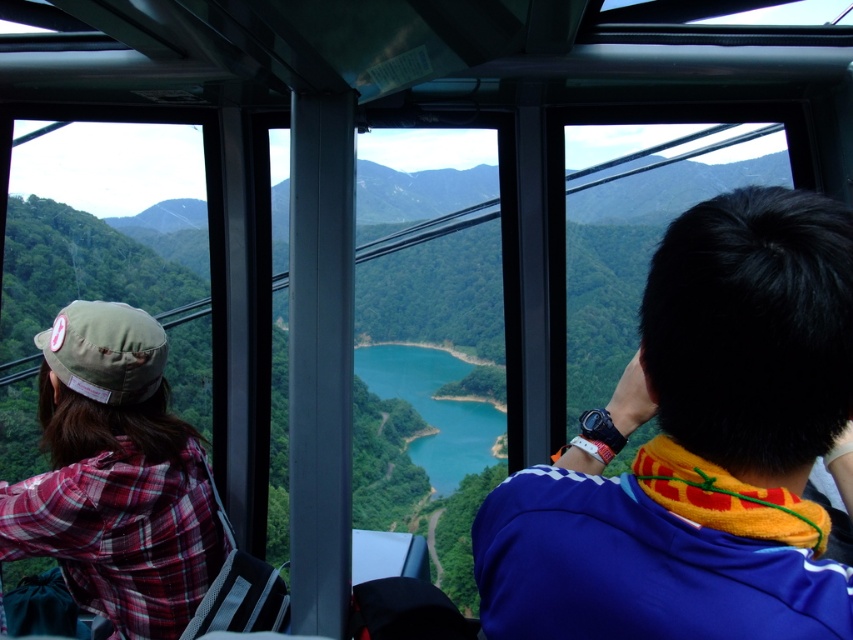
Can you confirm if blue fabric jacket at center is taller than plaid fabric shirt at left?

In fact, blue fabric jacket at center may be shorter than plaid fabric shirt at left.

Who is more distant from viewer, (505, 596) or (35, 492)?

The point (35, 492) is more distant.

The width and height of the screenshot is (853, 640). I want to click on blue fabric jacket at center, so (x=699, y=449).